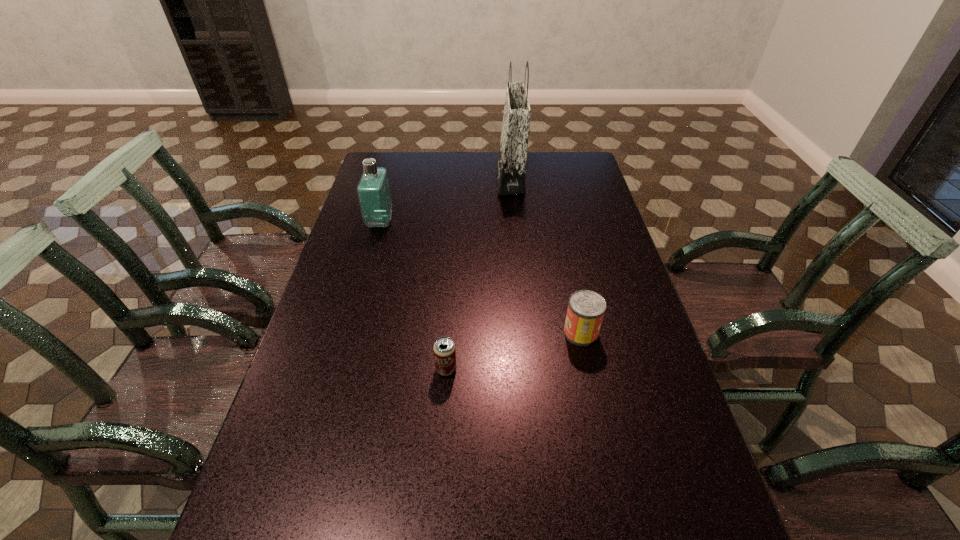
Identify the location of vacant space at the far left corner of the desktop. (394, 174).

In the image, there is a desktop. Identify the location of free space at the far right corner. This screenshot has height=540, width=960. (570, 159).

Where is `free spot between the second farthest object and the shopping bag`? The image size is (960, 540). free spot between the second farthest object and the shopping bag is located at coordinates (445, 200).

This screenshot has height=540, width=960. In order to click on free space between the rightmost object and the leftmost object in this screenshot , I will do `click(481, 278)`.

This screenshot has width=960, height=540. I want to click on free space between the can and the shortest object, so click(x=514, y=351).

Find the location of a particular element. This screenshot has height=540, width=960. free area in between the tallest object and the third farthest object is located at coordinates (545, 255).

Locate an element on the screen. This screenshot has width=960, height=540. empty space between the third object from left to right and the second tallest object is located at coordinates (445, 200).

Locate an element on the screen. vacant space that is in between the beer can and the perfume is located at coordinates (413, 296).

Locate an element on the screen. The height and width of the screenshot is (540, 960). free space that is in between the leftmost object and the second object from right to left is located at coordinates (445, 200).

Locate an element on the screen. free space between the leftmost object and the shortest object is located at coordinates (413, 296).